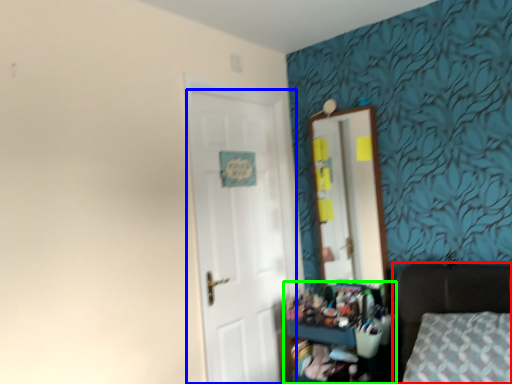
Question: Considering the real-world distances, which object is farthest from furniture (highlighted by a red box)? door (highlighted by a blue box) or dresser (highlighted by a green box)?

Choices:
 (A) door
 (B) dresser

Answer: (A)